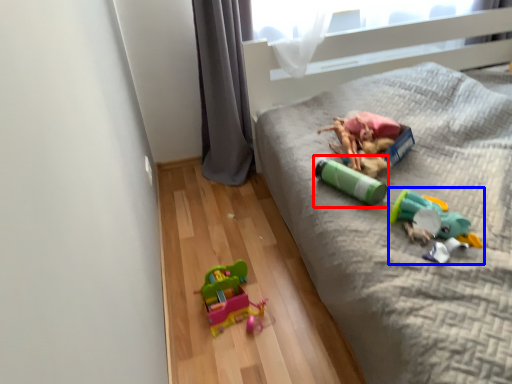
Question: Which of the following is the closest to the observer, toy (highlighted by a red box) or toy (highlighted by a blue box)?

Choices:
 (A) toy
 (B) toy

Answer: (B)